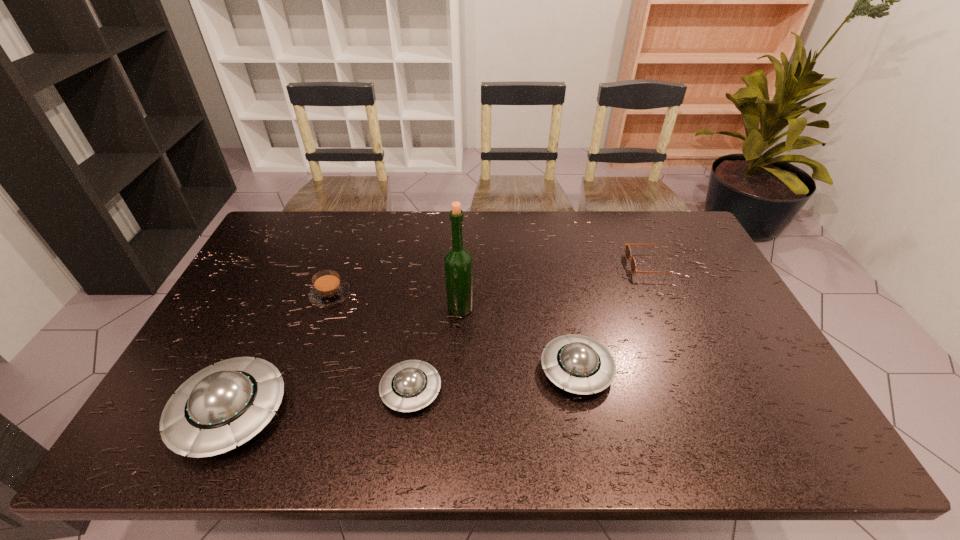
This screenshot has height=540, width=960. In order to click on blank area in the image that satisfies the following two spatial constraints: 1. on the front side of the second saucer from left to right; 2. on the right side of the cappuccino in this screenshot , I will do `click(297, 390)`.